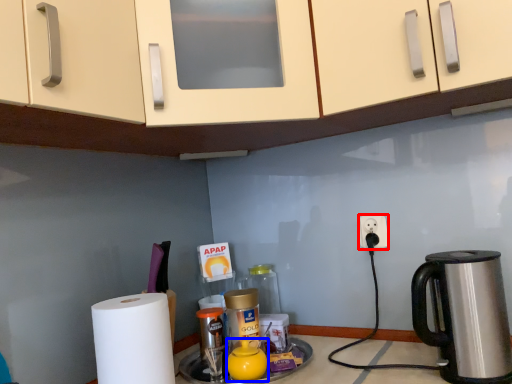
Question: Which of the following is the farthest to the observer, power outlet (highlighted by a red box) or tea pot (highlighted by a blue box)?

Choices:
 (A) power outlet
 (B) tea pot

Answer: (A)